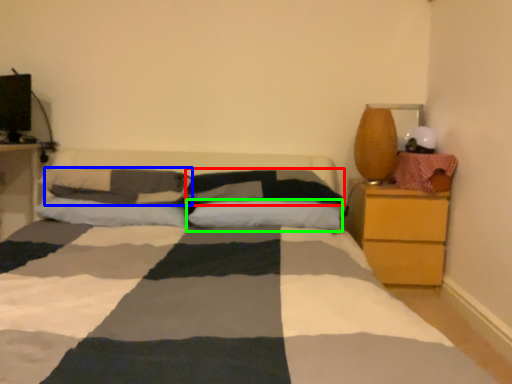
Question: Which object is the farthest from pillow (highlighted by a red box)? Choose among these: pillow (highlighted by a blue box) or pillow (highlighted by a green box).

Choices:
 (A) pillow
 (B) pillow

Answer: (A)